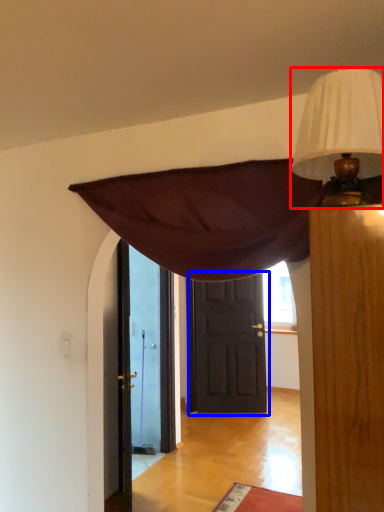
Question: Which of the following is the farthest to the observer, lamp (highlighted by a red box) or door (highlighted by a blue box)?

Choices:
 (A) lamp
 (B) door

Answer: (B)